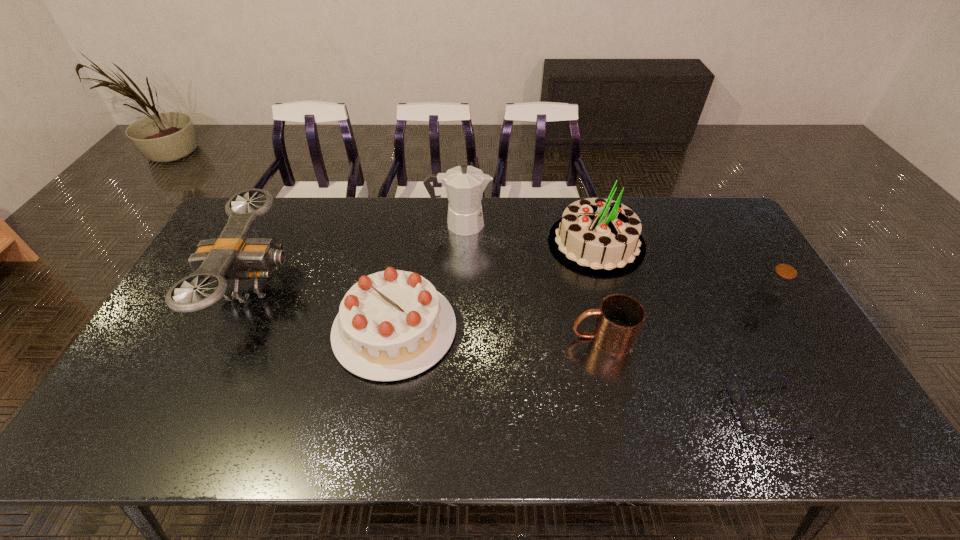
Where is `coffeepot`? coffeepot is located at coordinates (464, 184).

I want to click on the taller birthday cake, so click(x=599, y=237).

Where is `the farther birthday cake`? The width and height of the screenshot is (960, 540). the farther birthday cake is located at coordinates (599, 237).

Find the location of a particular element. the leftmost object is located at coordinates (233, 255).

I want to click on the fourth tallest object, so click(392, 325).

Identify the location of the nearer birthday cake. The width and height of the screenshot is (960, 540). (392, 325).

Find the location of a particular element. The image size is (960, 540). jar is located at coordinates (777, 284).

Find the location of a particular element. This screenshot has width=960, height=540. mug is located at coordinates (620, 317).

Find the location of a particular element. spectacles is located at coordinates (748, 419).

Locate an element on the screen. The height and width of the screenshot is (540, 960). the second object from right to left is located at coordinates (748, 419).